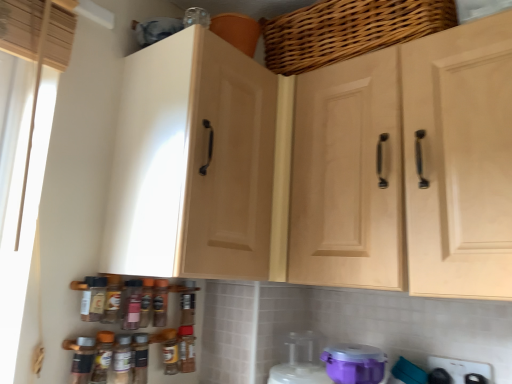
Question: From a real-world perspective, is light wood cabinet doors at center, which is counted as the 2th cabinetry, starting from the left, under purple plastic container at lower center, which is counted as the 3th appliance, starting from the right?

Choices:
 (A) yes
 (B) no

Answer: (B)

Question: Is light wood cabinet doors at center, which is counted as the 2th cabinetry, starting from the left, wider than purple plastic container at lower center, which is counted as the 3th appliance, starting from the right?

Choices:
 (A) yes
 (B) no

Answer: (A)

Question: Considering the relative positions of light wood cabinet doors at center, which is counted as the 2th cabinetry, starting from the left, and purple plastic container at lower center, the second appliance positioned from the left, in the image provided, is light wood cabinet doors at center, which is counted as the 2th cabinetry, starting from the left, behind purple plastic container at lower center, the second appliance positioned from the left,?

Choices:
 (A) no
 (B) yes

Answer: (A)

Question: Considering the relative positions of light wood cabinet doors at center, which is counted as the 2th cabinetry, starting from the left, and purple plastic container at lower center, the second appliance positioned from the left, in the image provided, is light wood cabinet doors at center, which is counted as the 2th cabinetry, starting from the left, to the right of purple plastic container at lower center, the second appliance positioned from the left, from the viewer's perspective?

Choices:
 (A) no
 (B) yes

Answer: (B)

Question: Is light wood cabinet doors at center, which is counted as the 2th cabinetry, starting from the left, facing away from purple plastic container at lower center, which is counted as the 3th appliance, starting from the right?

Choices:
 (A) no
 (B) yes

Answer: (A)

Question: Is light wood cabinet doors at center, positioned as the 1th cabinetry in right-to-left order, shorter than purple plastic container at lower center, which is counted as the 3th appliance, starting from the right?

Choices:
 (A) yes
 (B) no

Answer: (B)

Question: Would you say matte wood cabinet at left, the 2th cabinetry positioned from the right, contains purple plastic container at lower center, positioned as the 1th appliance in left-to-right order?

Choices:
 (A) no
 (B) yes

Answer: (A)

Question: Are matte wood cabinet at left, marked as the first cabinetry in a left-to-right arrangement, and purple plastic container at lower center, the 4th appliance from the right, making contact?

Choices:
 (A) yes
 (B) no

Answer: (B)

Question: Is matte wood cabinet at left, marked as the first cabinetry in a left-to-right arrangement, positioned far away from purple plastic container at lower center, the 4th appliance from the right?

Choices:
 (A) no
 (B) yes

Answer: (A)

Question: Is matte wood cabinet at left, marked as the first cabinetry in a left-to-right arrangement, completely or partially outside of purple plastic container at lower center, positioned as the 1th appliance in left-to-right order?

Choices:
 (A) no
 (B) yes

Answer: (B)

Question: From a real-world perspective, is matte wood cabinet at left, marked as the first cabinetry in a left-to-right arrangement, physically above purple plastic container at lower center, positioned as the 1th appliance in left-to-right order?

Choices:
 (A) yes
 (B) no

Answer: (A)

Question: Is matte wood cabinet at left, marked as the first cabinetry in a left-to-right arrangement, oriented away from purple plastic container at lower center, the 4th appliance from the right?

Choices:
 (A) yes
 (B) no

Answer: (B)

Question: Is purple plastic container at lower center, which is counted as the 3th appliance, starting from the right, positioned behind light wood cabinet doors at center, which is counted as the 2th cabinetry, starting from the left?

Choices:
 (A) no
 (B) yes

Answer: (B)